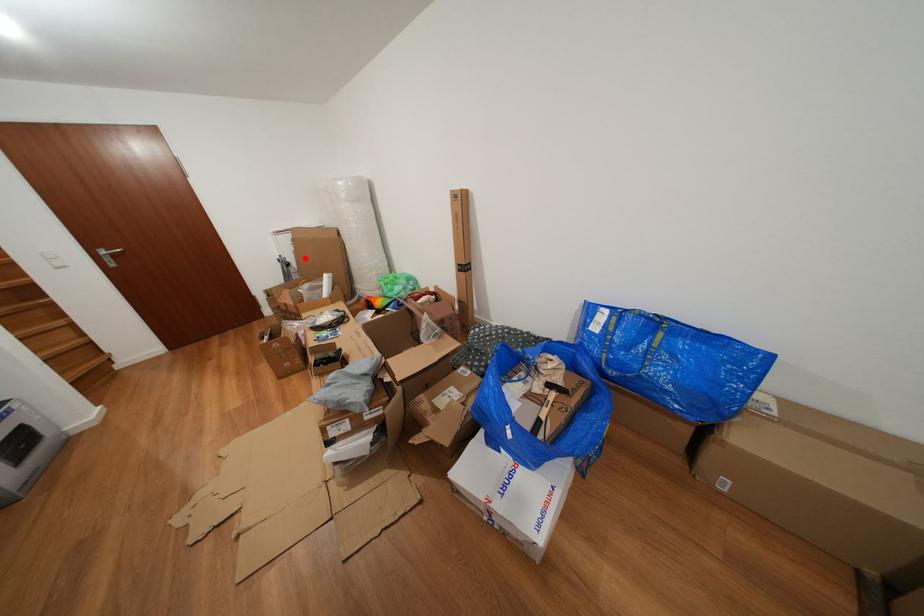
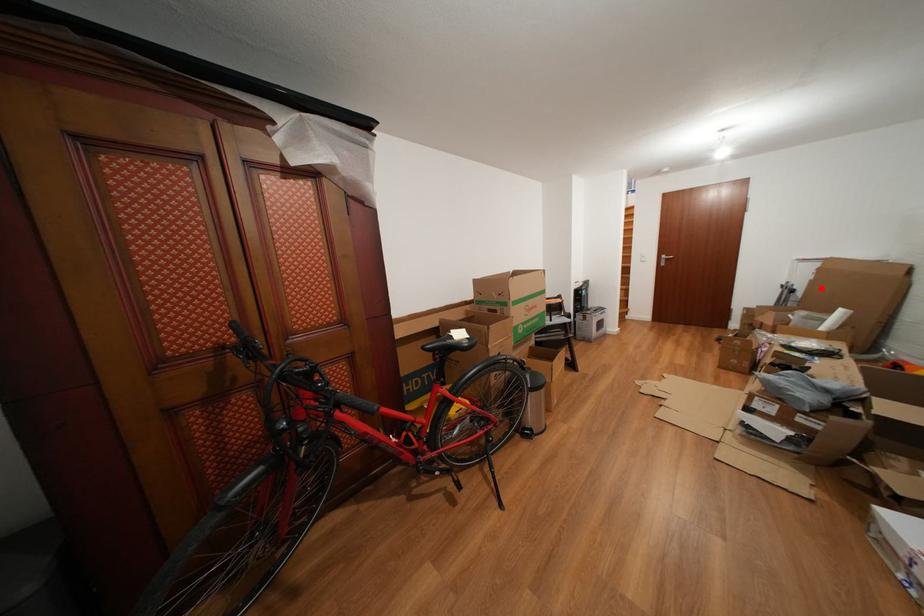
I am providing you with two images of the same scene from different viewpoints. A red point is marked on the first image and another point is marked on the second image. Are the points marked in image1 and image2 representing the same 3D position?

Yes